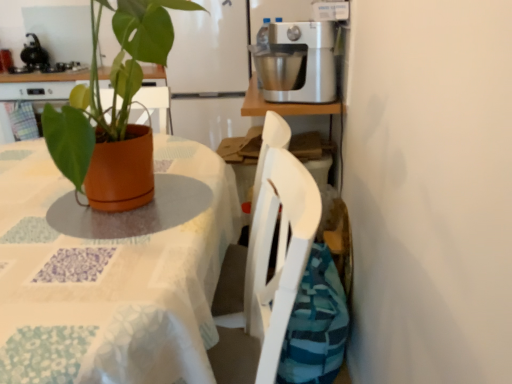
Measure the distance between terracotta pot at left and camera.

19.96 inches.

This screenshot has height=384, width=512. Identify the location of satin silver mixer at upper right. (296, 62).

Which is correct: terracotta pot at left is inside brushed metal mixer at upper center, or outside of it?

terracotta pot at left is outside brushed metal mixer at upper center.

In the scene shown: Considering the relative sizes of terracotta pot at left and brushed metal mixer at upper center in the image provided, is terracotta pot at left bigger than brushed metal mixer at upper center?

Correct, terracotta pot at left is larger in size than brushed metal mixer at upper center.

In the scene shown: From a real-world perspective, relative to brushed metal mixer at upper center, is terracotta pot at left vertically above or below?

terracotta pot at left is situated lower than brushed metal mixer at upper center in the real world.

Does terracotta pot at left touch brushed metal mixer at upper center?

No, terracotta pot at left is not making contact with brushed metal mixer at upper center.

Consider the image. From a real-world perspective, between terracotta pot at left and satin silver mixer at upper right, who is vertically higher?

From a 3D spatial view, satin silver mixer at upper right is above.

Considering the sizes of terracotta pot at left and satin silver mixer at upper right in the image, is terracotta pot at left wider or thinner than satin silver mixer at upper right?

Considering their sizes, terracotta pot at left looks broader than satin silver mixer at upper right.

Considering the sizes of terracotta pot at left and satin silver mixer at upper right in the image, is terracotta pot at left taller or shorter than satin silver mixer at upper right?

Considering their sizes, terracotta pot at left has more height than satin silver mixer at upper right.

What's the angular difference between terracotta pot at left and satin silver mixer at upper right's facing directions?

They differ by 1.62 degrees in their facing directions.

Looking at their sizes, would you say satin silver mixer at upper right is wider or thinner than brushed metal mixer at upper center?

Considering their sizes, satin silver mixer at upper right looks broader than brushed metal mixer at upper center.

Consider the image. Is brushed metal mixer at upper center located within satin silver mixer at upper right?

No.

Based on the photo, would you say satin silver mixer at upper right is a long distance from brushed metal mixer at upper center?

Yes, satin silver mixer at upper right is far from brushed metal mixer at upper center.

You are a GUI agent. You are given a task and a screenshot of the screen. Output one action in this format:
    pyautogui.click(x=<x>, y=<y>)
    Task: Click on the mixer below the satin silver mixer at upper right (from a real-world perspective)
    
    Given the screenshot: What is the action you would take?
    pyautogui.click(x=34, y=55)

Is satin silver mixer at upper right not near terracotta pot at left?

satin silver mixer at upper right is near terracotta pot at left, not far away.

Does satin silver mixer at upper right appear on the left side of terracotta pot at left?

In fact, satin silver mixer at upper right is to the right of terracotta pot at left.

Is terracotta pot at left completely or partially inside satin silver mixer at upper right?

No, satin silver mixer at upper right does not contain terracotta pot at left.

Looking at this image, considering the relative sizes of satin silver mixer at upper right and terracotta pot at left in the image provided, is satin silver mixer at upper right smaller than terracotta pot at left?

Yes, satin silver mixer at upper right is smaller than terracotta pot at left.

From a real-world perspective, relative to satin silver mixer at upper right, is brushed metal mixer at upper center vertically above or below?

From a real-world perspective, brushed metal mixer at upper center is physically below satin silver mixer at upper right.

Does point (25, 47) come behind point (332, 46)?

Yes, it is.

Is brushed metal mixer at upper center directly adjacent to satin silver mixer at upper right?

brushed metal mixer at upper center and satin silver mixer at upper right are not in contact.

Does brushed metal mixer at upper center have a smaller size compared to terracotta pot at left?

Yes.

From a real-world perspective, is brushed metal mixer at upper center under terracotta pot at left?

No.

Considering the relative sizes of brushed metal mixer at upper center and terracotta pot at left in the image provided, is brushed metal mixer at upper center shorter than terracotta pot at left?

Correct, brushed metal mixer at upper center is not as tall as terracotta pot at left.

Where is `mixer on the left of terracotta pot at left`? This screenshot has height=384, width=512. mixer on the left of terracotta pot at left is located at coordinates (34, 55).

What's the angular difference between terracotta pot at center and brushed metal mixer at upper center's facing directions?

The facing directions of terracotta pot at center and brushed metal mixer at upper center are 84.5 degrees apart.

Which is more to the right, terracotta pot at center or brushed metal mixer at upper center?

Positioned to the right is terracotta pot at center.

Between terracotta pot at center and brushed metal mixer at upper center, which one has more height?

With more height is terracotta pot at center.

Considering the sizes of terracotta pot at center and brushed metal mixer at upper center in the image, is terracotta pot at center wider or thinner than brushed metal mixer at upper center?

Clearly, terracotta pot at center has more width compared to brushed metal mixer at upper center.

Where is `mixer above the terracotta pot at left (from the image's perspective)`? The height and width of the screenshot is (384, 512). mixer above the terracotta pot at left (from the image's perspective) is located at coordinates (34, 55).

Locate an element on the screen. The height and width of the screenshot is (384, 512). table to the left of satin silver mixer at upper right is located at coordinates (112, 271).

Consider the image. Estimate the real-world distances between objects in this image. Which object is further from brushed metal mixer at upper center, terracotta pot at left or satin silver mixer at upper right?

Among the two, terracotta pot at left is located further to brushed metal mixer at upper center.

Based on their spatial positions, is brushed metal mixer at upper center or satin silver mixer at upper right further from terracotta pot at center?

brushed metal mixer at upper center is positioned further to the anchor terracotta pot at center.

Based on their spatial positions, is brushed metal mixer at upper center or terracotta pot at left closer to terracotta pot at center?

Based on the image, terracotta pot at left appears to be nearer to terracotta pot at center.

Estimate the real-world distances between objects in this image. Which object is further from terracotta pot at center, satin silver mixer at upper right or brushed metal mixer at upper center?

brushed metal mixer at upper center is further to terracotta pot at center.

From the image, which object appears to be nearer to terracotta pot at center, terracotta pot at left or satin silver mixer at upper right?

terracotta pot at left is closer to terracotta pot at center.

Considering their positions, is satin silver mixer at upper right positioned further to terracotta pot at center than terracotta pot at left?

The object further to terracotta pot at center is satin silver mixer at upper right.

Looking at the image, which one is located further to brushed metal mixer at upper center, terracotta pot at center or satin silver mixer at upper right?

Based on the image, terracotta pot at center appears to be further to brushed metal mixer at upper center.

Consider the image. Estimate the real-world distances between objects in this image. Which object is closer to satin silver mixer at upper right, terracotta pot at left or terracotta pot at center?

Among the two, terracotta pot at center is located nearer to satin silver mixer at upper right.

This screenshot has width=512, height=384. I want to click on houseplant between terracotta pot at left and brushed metal mixer at upper center from front to back, so click(x=113, y=112).

Locate an element on the screen. kitchen appliance positioned between terracotta pot at left and brushed metal mixer at upper center from near to far is located at coordinates (296, 62).

Locate an element on the screen. The width and height of the screenshot is (512, 384). houseplant located between terracotta pot at left and satin silver mixer at upper right in the depth direction is located at coordinates (113, 112).

At what (x,y) coordinates should I click in order to perform the action: click on kitchen appliance between terracotta pot at center and brushed metal mixer at upper center from front to back. Please return your answer as a coordinate pair (x, y). Image resolution: width=512 pixels, height=384 pixels. Looking at the image, I should click on (296, 62).